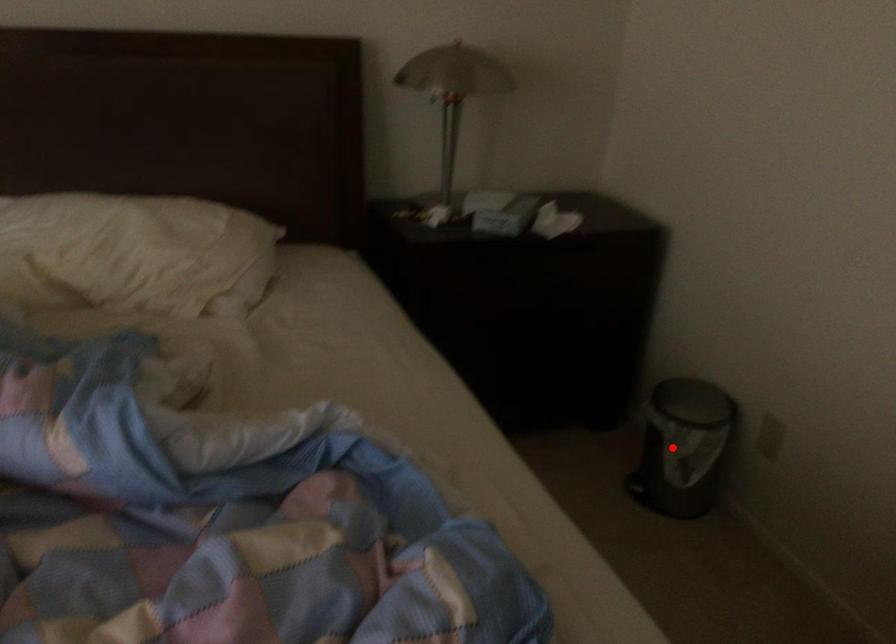
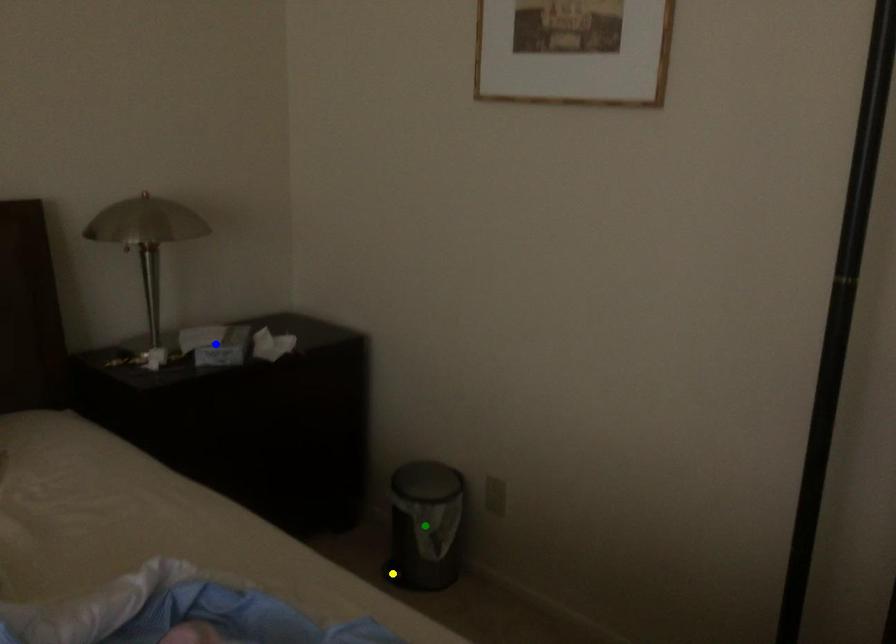
Question: I am providing you with two images of the same scene from different viewpoints. A red point is marked on the first image. You are given multiple points on the second image. In image 2, which mark is for the same physical point as the one in image 1?

Choices:
 (A) blue point
 (B) yellow point
 (C) green point

Answer: (C)